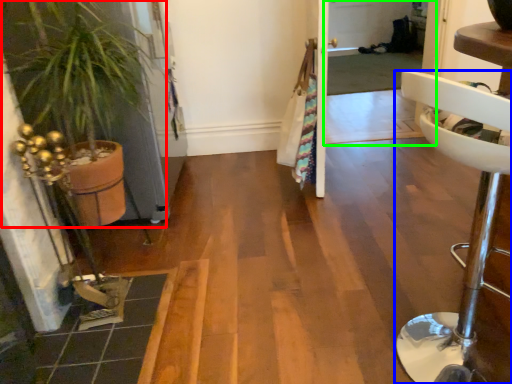
Question: Which object is the farthest from houseplant (highlighted by a red box)? Choose among these: furniture (highlighted by a blue box) or screen door (highlighted by a green box).

Choices:
 (A) furniture
 (B) screen door

Answer: (B)